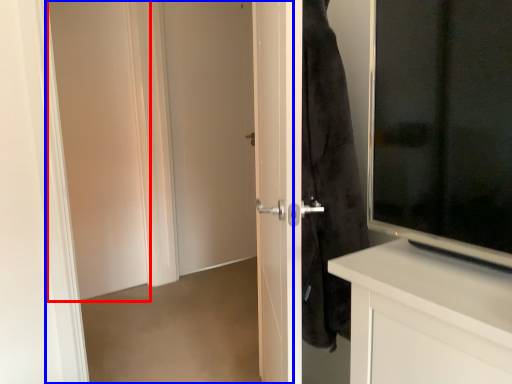
Question: Which object is closer to the camera taking this photo, screen door (highlighted by a red box) or screen door (highlighted by a blue box)?

Choices:
 (A) screen door
 (B) screen door

Answer: (B)